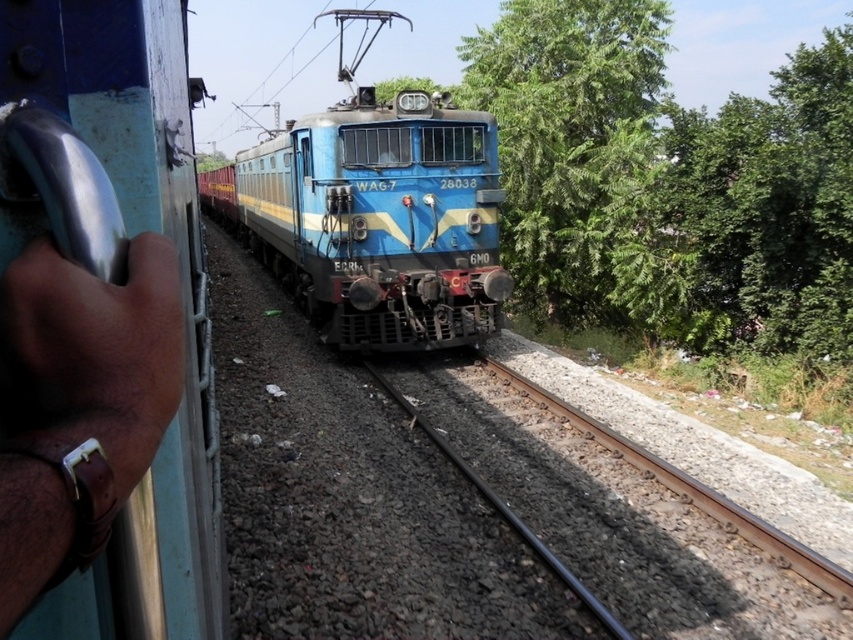
You are a pedestrian standing at the edge of the railway track. You see a green leafy tree at center and a blue glossy train at center. If you want to cross the railway track safely, which object should you pay attention to first and why?

You should pay attention to the blue glossy train at center first because it is a moving object on the railway track, and ensuring it has passed completely is crucial for safe crossing. The green leafy tree at center is stationary and does not pose an immediate danger.

You are a construction worker inspecting the railway tracks. You need to ensure that the black asphalt track at center can support the weight of the blue glossy train at center. Based on their heights, can you determine if the track is adequate?

The black asphalt track at center is not as tall as the blue glossy train at center, which suggests that the track is adequate in height to support the train.